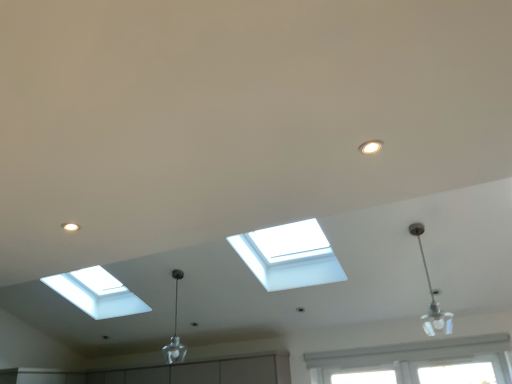
Find the location of a particular element. clear glass pendant at center, which is counted as the first lamp, starting from the back is located at coordinates (175, 331).

Image resolution: width=512 pixels, height=384 pixels. Describe the element at coordinates (175, 331) in the screenshot. I see `clear glass pendant at center, which ranks as the second lamp in front-to-back order` at that location.

This screenshot has width=512, height=384. What are the coordinates of `silver metallic pendant light at right, which appears as the 1th lamp when viewed from the right` in the screenshot? It's located at (432, 296).

This screenshot has height=384, width=512. What do you see at coordinates (432, 296) in the screenshot?
I see `silver metallic pendant light at right, which appears as the 1th lamp when viewed from the right` at bounding box center [432, 296].

What is the approximate height of silver metallic pendant light at right, placed as the 1th lamp when sorted from front to back?

silver metallic pendant light at right, placed as the 1th lamp when sorted from front to back, is 70.35 centimeters tall.

This screenshot has width=512, height=384. Identify the location of clear glass pendant at center, positioned as the second lamp in right-to-left order. (175, 331).

Which object is positioned more to the left, silver metallic pendant light at right, the second lamp when ordered from left to right, or clear glass pendant at center, positioned as the second lamp in right-to-left order?

From the viewer's perspective, clear glass pendant at center, positioned as the second lamp in right-to-left order, appears more on the left side.

Which object is closer to the camera, silver metallic pendant light at right, marked as the 2th lamp in a back-to-front arrangement, or clear glass pendant at center, which ranks as the second lamp in front-to-back order?

silver metallic pendant light at right, marked as the 2th lamp in a back-to-front arrangement, is closer to the camera.

Is point (436, 312) farther from camera compared to point (168, 360)?

No, (436, 312) is closer to viewer.

From the image's perspective, does silver metallic pendant light at right, placed as the 1th lamp when sorted from front to back, appear higher than clear glass pendant at center, positioned as the second lamp in right-to-left order?

Yes, from the image's perspective, silver metallic pendant light at right, placed as the 1th lamp when sorted from front to back, is above clear glass pendant at center, positioned as the second lamp in right-to-left order.

From a real-world perspective, is silver metallic pendant light at right, placed as the 1th lamp when sorted from front to back, above or below clear glass pendant at center, which is counted as the first lamp, starting from the back?

silver metallic pendant light at right, placed as the 1th lamp when sorted from front to back, is above clear glass pendant at center, which is counted as the first lamp, starting from the back.

Can you confirm if silver metallic pendant light at right, placed as the 1th lamp when sorted from front to back, is thinner than clear glass pendant at center, which is the 1th lamp in left-to-right order?

In fact, silver metallic pendant light at right, placed as the 1th lamp when sorted from front to back, might be wider than clear glass pendant at center, which is the 1th lamp in left-to-right order.

Is silver metallic pendant light at right, the second lamp when ordered from left to right, shorter than clear glass pendant at center, which ranks as the second lamp in front-to-back order?

Yes.

Looking at the image, does silver metallic pendant light at right, placed as the 1th lamp when sorted from front to back, seem bigger or smaller compared to clear glass pendant at center, which ranks as the second lamp in front-to-back order?

In the image, silver metallic pendant light at right, placed as the 1th lamp when sorted from front to back, appears to be smaller than clear glass pendant at center, which ranks as the second lamp in front-to-back order.

Is silver metallic pendant light at right, marked as the 2th lamp in a back-to-front arrangement, inside or outside of clear glass pendant at center, which ranks as the second lamp in front-to-back order?

A: silver metallic pendant light at right, marked as the 2th lamp in a back-to-front arrangement, cannot be found inside clear glass pendant at center, which ranks as the second lamp in front-to-back order.

Consider the image. Is silver metallic pendant light at right, the second lamp when ordered from left to right, beside clear glass pendant at center, positioned as the second lamp in right-to-left order?

No.

Is silver metallic pendant light at right, placed as the 1th lamp when sorted from front to back, positioned with its back to clear glass pendant at center, which is the 1th lamp in left-to-right order?

No, clear glass pendant at center, which is the 1th lamp in left-to-right order, is not at the back of silver metallic pendant light at right, placed as the 1th lamp when sorted from front to back.

What's the angular difference between silver metallic pendant light at right, the second lamp when ordered from left to right, and clear glass pendant at center, positioned as the second lamp in right-to-left order,'s facing directions?

The angle between the facing direction of silver metallic pendant light at right, the second lamp when ordered from left to right, and the facing direction of clear glass pendant at center, positioned as the second lamp in right-to-left order, is 2.6 degrees.

This screenshot has height=384, width=512. In the image, there is a clear glass pendant at center, which is counted as the first lamp, starting from the back. In order to click on lamp above it (from the image's perspective) in this screenshot , I will do pyautogui.click(x=432, y=296).

Does clear glass pendant at center, positioned as the second lamp in right-to-left order, appear on the right side of silver metallic pendant light at right, which appears as the 1th lamp when viewed from the right?

Incorrect, clear glass pendant at center, positioned as the second lamp in right-to-left order, is not on the right side of silver metallic pendant light at right, which appears as the 1th lamp when viewed from the right.

Does clear glass pendant at center, positioned as the second lamp in right-to-left order, lie in front of silver metallic pendant light at right, marked as the 2th lamp in a back-to-front arrangement?

No.

Between point (174, 352) and point (447, 328), which one is positioned in front?

The point (447, 328) is closer.

From the image's perspective, is clear glass pendant at center, positioned as the second lamp in right-to-left order, above silver metallic pendant light at right, which appears as the 1th lamp when viewed from the right?

Incorrect, from the image's perspective, clear glass pendant at center, positioned as the second lamp in right-to-left order, is lower than silver metallic pendant light at right, which appears as the 1th lamp when viewed from the right.

From a real-world perspective, is clear glass pendant at center, which ranks as the second lamp in front-to-back order, physically above silver metallic pendant light at right, the second lamp when ordered from left to right?

Incorrect, from a real-world perspective, clear glass pendant at center, which ranks as the second lamp in front-to-back order, is lower than silver metallic pendant light at right, the second lamp when ordered from left to right.

Does clear glass pendant at center, positioned as the second lamp in right-to-left order, have a lesser width compared to silver metallic pendant light at right, placed as the 1th lamp when sorted from front to back?

Correct, the width of clear glass pendant at center, positioned as the second lamp in right-to-left order, is less than that of silver metallic pendant light at right, placed as the 1th lamp when sorted from front to back.

Looking at this image, which of these two, clear glass pendant at center, which ranks as the second lamp in front-to-back order, or silver metallic pendant light at right, placed as the 1th lamp when sorted from front to back, stands taller?

Standing taller between the two is clear glass pendant at center, which ranks as the second lamp in front-to-back order.

Is clear glass pendant at center, which is counted as the first lamp, starting from the back, bigger or smaller than silver metallic pendant light at right, the second lamp when ordered from left to right?

Clearly, clear glass pendant at center, which is counted as the first lamp, starting from the back, is larger in size than silver metallic pendant light at right, the second lamp when ordered from left to right.

Looking at this image, is clear glass pendant at center, which is the 1th lamp in left-to-right order, not within silver metallic pendant light at right, marked as the 2th lamp in a back-to-front arrangement?

Yes, clear glass pendant at center, which is the 1th lamp in left-to-right order, is located beyond the bounds of silver metallic pendant light at right, marked as the 2th lamp in a back-to-front arrangement.

In the scene shown: Is clear glass pendant at center, which is the 1th lamp in left-to-right order, far from silver metallic pendant light at right, placed as the 1th lamp when sorted from front to back?

Yes, clear glass pendant at center, which is the 1th lamp in left-to-right order, is far from silver metallic pendant light at right, placed as the 1th lamp when sorted from front to back.

Is clear glass pendant at center, which ranks as the second lamp in front-to-back order, turned away from silver metallic pendant light at right, the second lamp when ordered from left to right?

No.

You are a GUI agent. You are given a task and a screenshot of the screen. Output one action in this format:
    pyautogui.click(x=<x>, y=<y>)
    Task: Click on the lamp on the right side of clear glass pendant at center, which is counted as the first lamp, starting from the back
    Image resolution: width=512 pixels, height=384 pixels.
    Given the screenshot: What is the action you would take?
    pyautogui.click(x=432, y=296)

Identify the location of lamp on the left of the silver metallic pendant light at right, placed as the 1th lamp when sorted from front to back. (175, 331).

Identify the location of lamp that appears above the clear glass pendant at center, which is counted as the first lamp, starting from the back (from a real-world perspective). The image size is (512, 384). (432, 296).